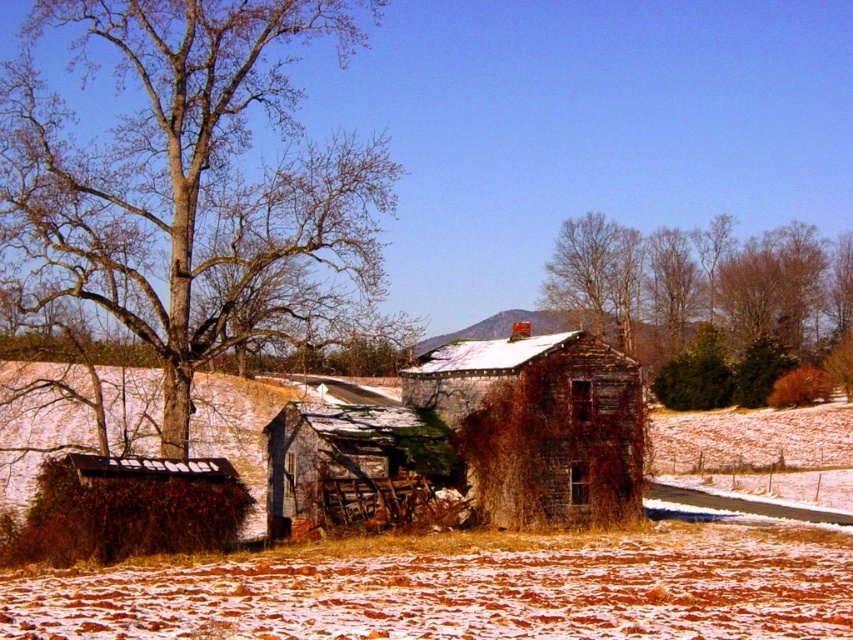
Is brown textured tree at upper right bigger than rusty metal hut at center?

Correct, brown textured tree at upper right is larger in size than rusty metal hut at center.

Does brown textured tree at upper right have a lesser height compared to rusty metal hut at center?

In fact, brown textured tree at upper right may be taller than rusty metal hut at center.

What do you see at coordinates (705, 305) in the screenshot? The height and width of the screenshot is (640, 853). I see `brown textured tree at upper right` at bounding box center [705, 305].

Identify the location of brown textured tree at upper right. Image resolution: width=853 pixels, height=640 pixels. (705, 305).

Which is behind, point (672, 394) or point (618, 380)?

Point (672, 394)

Can you confirm if brown textured tree at upper right is smaller than rusty stone hut at center?

Actually, brown textured tree at upper right might be larger than rusty stone hut at center.

The image size is (853, 640). In order to click on brown textured tree at upper right in this screenshot , I will do `click(705, 305)`.

Is rusty stone hut at center further to camera compared to rusty metal hut at center?

That is True.

Who is higher up, rusty stone hut at center or rusty metal hut at center?

rusty stone hut at center is above.

Is point (519, 476) positioned in front of point (273, 522)?

Yes, point (519, 476) is closer to viewer.

You are a GUI agent. You are given a task and a screenshot of the screen. Output one action in this format:
    pyautogui.click(x=<x>, y=<y>)
    Task: Click on the rusty stone hut at center
    The width and height of the screenshot is (853, 640).
    Given the screenshot: What is the action you would take?
    [x=538, y=422]